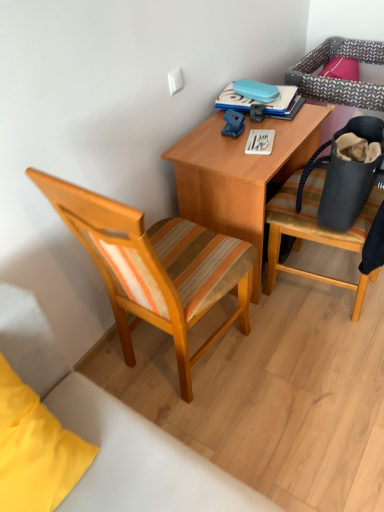
Question: Does matte black bag at right touch blue hardcover book at upper center?

Choices:
 (A) yes
 (B) no

Answer: (B)

Question: Is matte black bag at right to the right of blue hardcover book at upper center from the viewer's perspective?

Choices:
 (A) no
 (B) yes

Answer: (B)

Question: Is matte black bag at right not close to blue hardcover book at upper center?

Choices:
 (A) no
 (B) yes

Answer: (A)

Question: Is the depth of matte black bag at right greater than that of blue hardcover book at upper center?

Choices:
 (A) yes
 (B) no

Answer: (B)

Question: Can you confirm if matte black bag at right is shorter than blue hardcover book at upper center?

Choices:
 (A) no
 (B) yes

Answer: (A)

Question: Looking at their shapes, would you say woodenchair at left, which is counted as the second chair, starting from the right, is wider or thinner than blue hardcover book at upper center?

Choices:
 (A) thin
 (B) wide

Answer: (B)

Question: From their relative heights in the image, would you say woodenchair at left, which is counted as the second chair, starting from the right, is taller or shorter than blue hardcover book at upper center?

Choices:
 (A) short
 (B) tall

Answer: (B)

Question: Considering the relative positions of woodenchair at left, the first chair positioned from the left, and blue hardcover book at upper center in the image provided, is woodenchair at left, the first chair positioned from the left, to the left or to the right of blue hardcover book at upper center?

Choices:
 (A) left
 (B) right

Answer: (A)

Question: From the image's perspective, is woodenchair at left, the first chair positioned from the left, above or below blue hardcover book at upper center?

Choices:
 (A) below
 (B) above

Answer: (A)

Question: Relative to wooden desk at center, is wooden striped cushioned chair at right, the 2th chair viewed from the left, in front or behind?

Choices:
 (A) behind
 (B) front

Answer: (B)

Question: Considering the positions of wooden striped cushioned chair at right, the 2th chair viewed from the left, and wooden desk at center in the image, is wooden striped cushioned chair at right, the 2th chair viewed from the left, taller or shorter than wooden desk at center?

Choices:
 (A) tall
 (B) short

Answer: (A)

Question: Is wooden striped cushioned chair at right, the 2th chair viewed from the left, inside the boundaries of wooden desk at center, or outside?

Choices:
 (A) outside
 (B) inside

Answer: (A)

Question: Is point (304, 275) closer or farther from the camera than point (173, 147)?

Choices:
 (A) farther
 (B) closer

Answer: (A)

Question: In terms of size, does wooden desk at center appear bigger or smaller than matte black bag at right?

Choices:
 (A) small
 (B) big

Answer: (B)

Question: From the image's perspective, is wooden desk at center above or below matte black bag at right?

Choices:
 (A) above
 (B) below

Answer: (B)